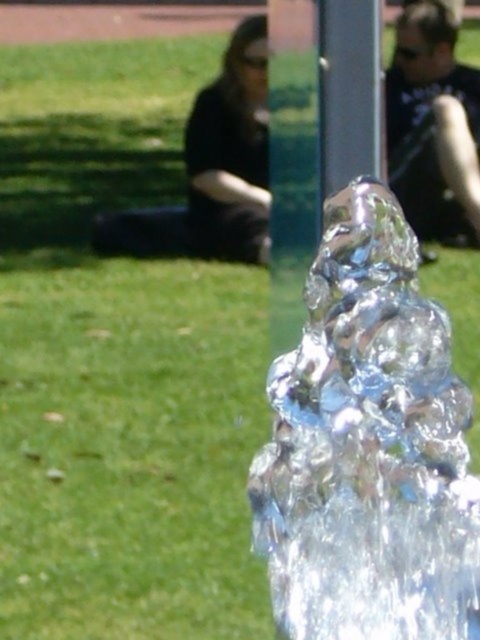
Does clear glass water at center have a larger size compared to matte black shirt at upper right?

Indeed, clear glass water at center has a larger size compared to matte black shirt at upper right.

This screenshot has height=640, width=480. I want to click on clear glass water at center, so click(x=369, y=448).